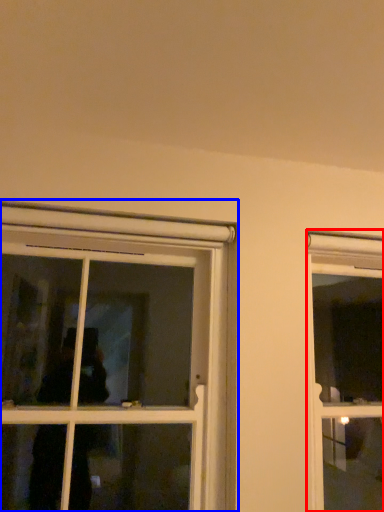
Question: Which of the following is the closest to the observer, window (highlighted by a red box) or window (highlighted by a blue box)?

Choices:
 (A) window
 (B) window

Answer: (B)